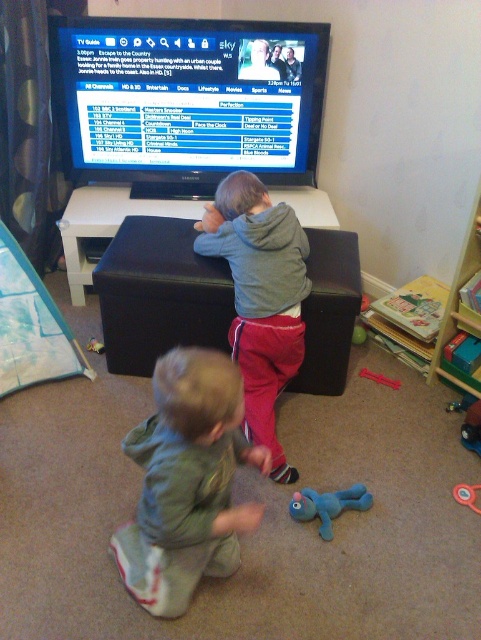
You are a parent in the room and you want to give your child a toy. You have the rubber ring at lower right and the rubber duck at lower center. Which toy is closer to the right side of the room?

The rubber ring at lower right is positioned on the right side of the rubber duck at lower center, so it is closer to the right side of the room.

You are a parent trying to locate your child who is playing with a rubberized plastic toy at lower center and a rubber duck at lower center. According to the scene, which toy is positioned to the right side of the other?

The rubberized plastic toy at lower center is positioned to the right of the rubber duck at lower center.

You are a parent in the room and want to place a small toy on the surface that is higher between the matte black tv guide at upper center and the rubber green ball at center. Which object should you choose?

The matte black tv guide at upper center is taller than the rubber green ball at center, so you should choose the matte black tv guide at upper center as it is the higher surface.